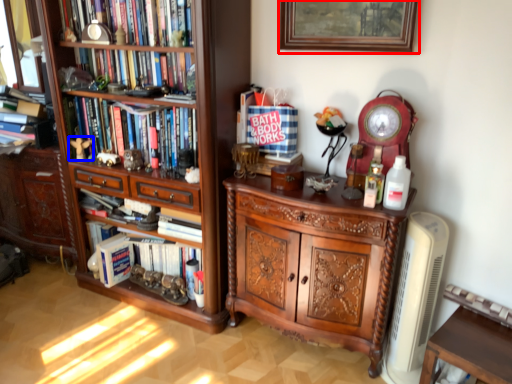
Question: Which object appears farthest to the camera in this image, picture frame (highlighted by a red box) or toy (highlighted by a blue box)?

Choices:
 (A) picture frame
 (B) toy

Answer: (B)